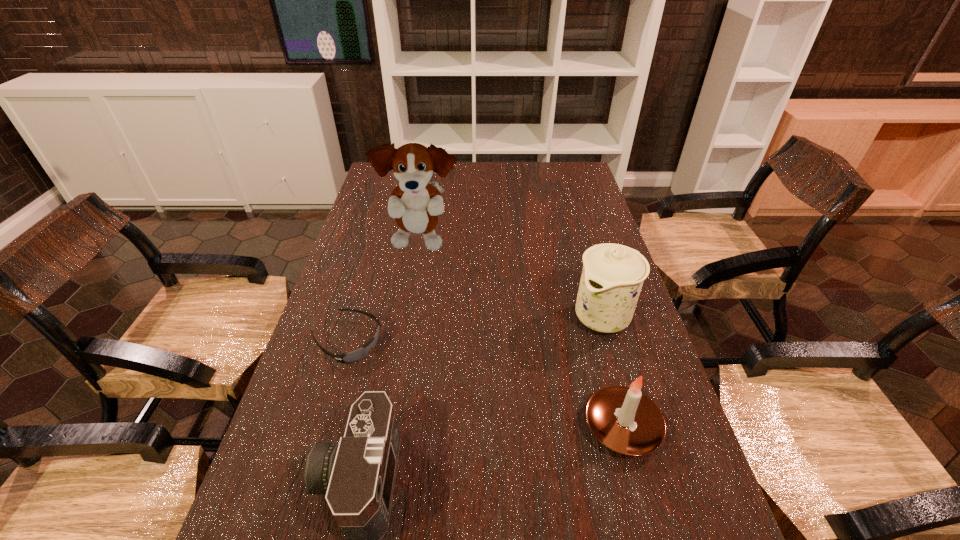
You are a GUI agent. You are given a task and a screenshot of the screen. Output one action in this format:
    pyautogui.click(x=<x>, y=<y>)
    Task: Click on the candle
    This screenshot has width=960, height=540.
    Given the screenshot: What is the action you would take?
    pyautogui.click(x=625, y=420)

Locate an element on the screen. puppy is located at coordinates (414, 203).

Locate an element on the screen. the farthest object is located at coordinates (414, 203).

Where is `the shortest object`? The image size is (960, 540). the shortest object is located at coordinates (351, 357).

At what (x,y) coordinates should I click in order to perform the action: click on the second tallest object. Please return your answer as a coordinate pair (x, y). This screenshot has height=540, width=960. Looking at the image, I should click on (612, 277).

Identify the location of vacant region located on the left of the third tallest object. (432, 427).

This screenshot has height=540, width=960. Identify the location of vacant point located 0.300m on the face of the tallest object. (450, 332).

Identify the location of vacant space positioned 0.320m on the face of the tallest object. (452, 338).

Where is `vacant space located on the face of the tallest object`? vacant space located on the face of the tallest object is located at coordinates [x=436, y=285].

This screenshot has width=960, height=540. I want to click on vacant space located on the lenses of the sunglasses, so click(412, 377).